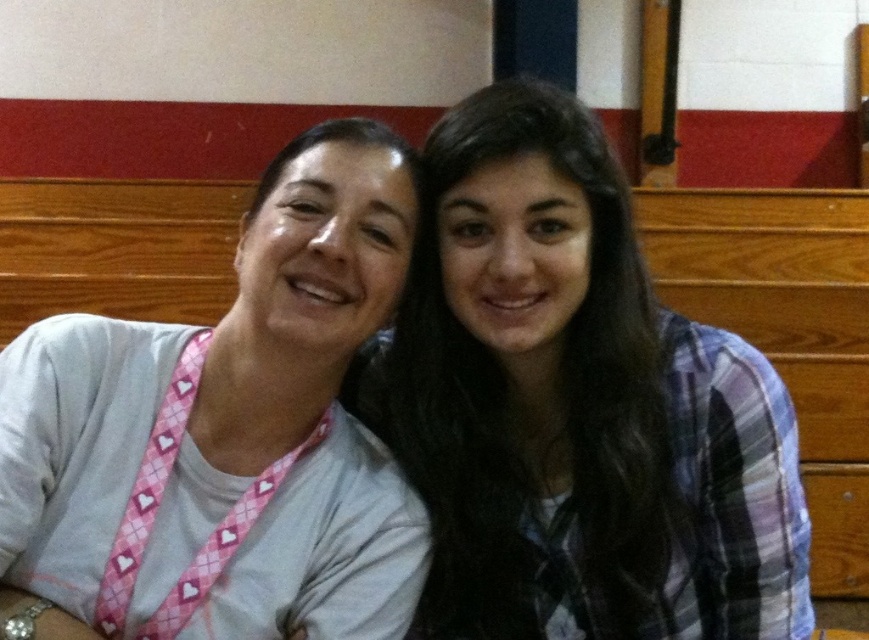
You are standing at the camera position and want to throw a ball to a friend who is at point (12, 493). There is an obstacle at point (735, 372). Will the ball pass over the obstacle?

Point (735, 372) is behind point (12, 493), so the ball will not hit the obstacle and will reach your friend.

You are a photographer setting up a shot in the gymnasium. You need to ensure that the plaid fabric shirt at center and the pink argyle lanyard at left are both in focus. Given that your camera has a depth of field that can sharply focus on objects within a 5 inch range, will both items be in focus?

The plaid fabric shirt at center is 7.33 inches away from the pink argyle lanyard at left. Since the distance between them exceeds the 5 inch depth of field range, not both items can be in focus simultaneously.

You are trying to decide which item to pack for a quick trip. You can only choose between the plaid fabric shirt at center and the pink argyle lanyard at left. Based on their sizes, which one takes up more space?

The plaid fabric shirt at center has a larger width than the pink argyle lanyard at left, so it takes up more space.